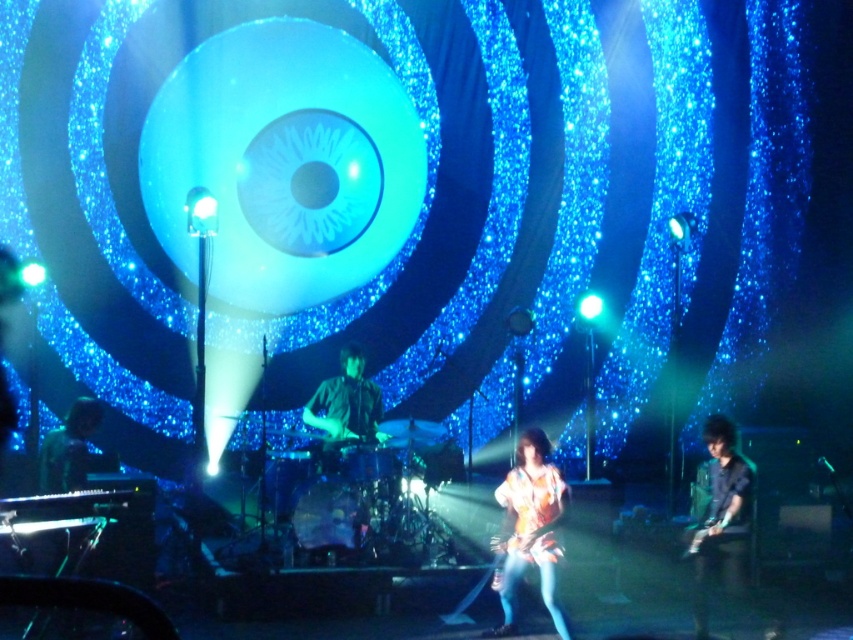
Question: Which point is farther to the camera?

Choices:
 (A) (352, 401)
 (B) (735, 456)

Answer: (A)

Question: Is floral-patterned shirt at center thinner than shiny black keyboard at lower left?

Choices:
 (A) yes
 (B) no

Answer: (B)

Question: Is shiny black guitar at center to the left of shiny black keyboard at lower left from the viewer's perspective?

Choices:
 (A) yes
 (B) no

Answer: (B)

Question: Among these objects, which one is nearest to the camera?

Choices:
 (A) floral-patterned shirt at center
 (B) shiny black keyboard at lower left
 (C) dark blue shirt at right
 (D) shiny black guitar at center

Answer: (A)

Question: Which point is farther from the camera taking this photo?

Choices:
 (A) (74, 401)
 (B) (553, 566)
 (C) (706, 422)
 (D) (364, 422)

Answer: (D)

Question: Can you confirm if dark blue shirt at right is smaller than shiny black keyboard at lower left?

Choices:
 (A) no
 (B) yes

Answer: (A)